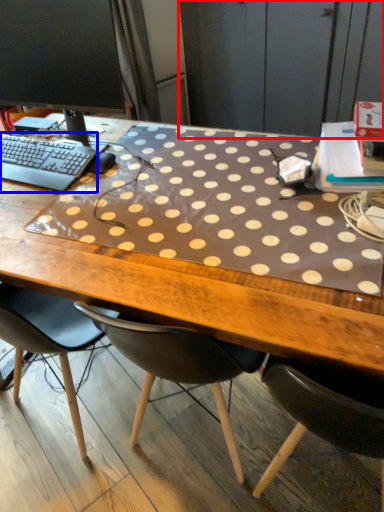
Question: Which of the following is the farthest to the observer, dresser (highlighted by a red box) or computer keyboard (highlighted by a blue box)?

Choices:
 (A) dresser
 (B) computer keyboard

Answer: (A)